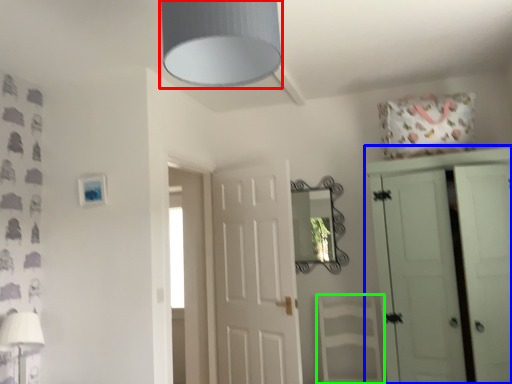
Question: Which object is the farthest from light fixture (highlighted by a red box)? Choose among these: cupboard (highlighted by a blue box) or armchair (highlighted by a green box).

Choices:
 (A) cupboard
 (B) armchair

Answer: (B)